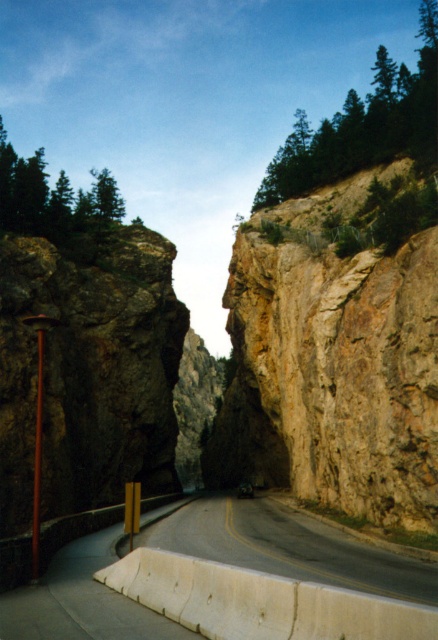
Does white concrete barrier at lower center appear under green leafy tree at upper left?

Indeed, white concrete barrier at lower center is positioned under green leafy tree at upper left.

Does white concrete barrier at lower center lie in front of green leafy tree at upper left?

That is True.

Does point (184, 548) lie in front of point (103, 224)?

That is True.

You are a GUI agent. You are given a task and a screenshot of the screen. Output one action in this format:
    pyautogui.click(x=<x>, y=<y>)
    Task: Click on the white concrete barrier at lower center
    The height and width of the screenshot is (640, 438).
    Given the screenshot: What is the action you would take?
    pyautogui.click(x=288, y=547)

Which is above, white concrete barrier at lower center or green textured trees at upper right?

Positioned higher is green textured trees at upper right.

Does point (304, 536) come closer to viewer compared to point (434, 67)?

Yes, it is.

I want to click on white concrete barrier at lower center, so click(288, 547).

Can you confirm if brown rough rock face at right is positioned below white concrete barrier at lower center?

No, brown rough rock face at right is not below white concrete barrier at lower center.

Is point (289, 458) less distant than point (222, 529)?

No, (289, 458) is further to viewer.

This screenshot has height=640, width=438. Identify the location of brown rough rock face at right. (341, 362).